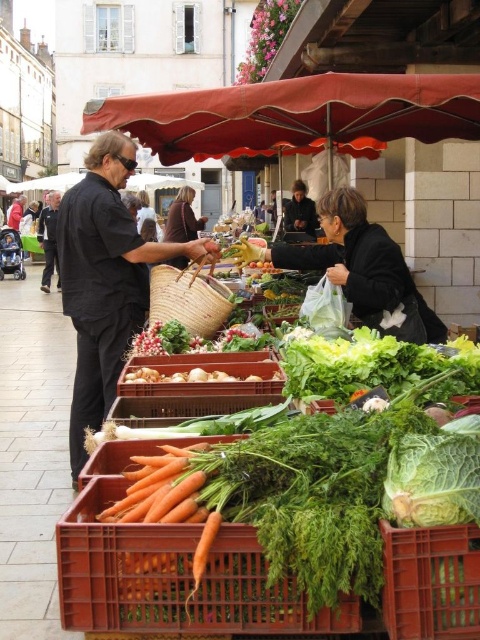
You are a customer at the market who wants to carry both the green plastic crate at lower center and the woven straw basket at center. If you can only carry items within 25 feet of each other, can you pick them up at the same time?

The distance between the green plastic crate at lower center and the woven straw basket at center is 24.05 feet, which is within the 25 feet limit. Therefore, you can pick them up at the same time.

You are standing at the entrance of the market and see the green plastic crate at lower center. Based on its coordinates, can you determine if it is positioned closer to the right edge or the left edge of the market stall?

The green plastic crate at lower center is located at point 0.909 on the x and y axis, which means it is closer to the right edge of the market stall.